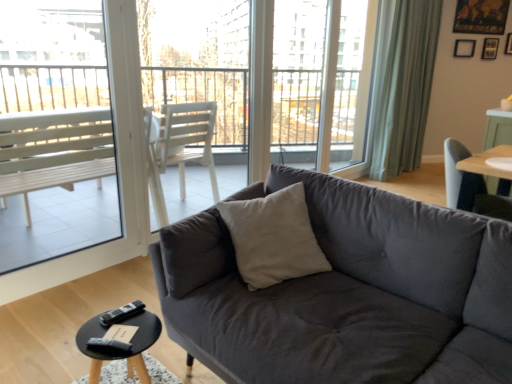
Question: Considering the positions of white plastic bench at left, marked as the first window screen in a left-to-right arrangement, and green fabric curtain at upper right in the image, is white plastic bench at left, marked as the first window screen in a left-to-right arrangement, taller or shorter than green fabric curtain at upper right?

Choices:
 (A) tall
 (B) short

Answer: (B)

Question: Considering the positions of point (113, 205) and point (388, 28), is point (113, 205) closer or farther from the camera than point (388, 28)?

Choices:
 (A) farther
 (B) closer

Answer: (B)

Question: Estimate the real-world distances between objects in this image. Which object is farther from the dark gray fabric couch at center?

Choices:
 (A) black plastic remote at lower left, which is the second remote in back-to-front order
 (B) wooden picture frame at upper right, which is counted as the 2th picture frame, starting from the left
 (C) light blue fabric chair at right
 (D) transparent glass screen door at upper center
 (E) black wood coffee table at lower left

Answer: (B)

Question: Which object is the farthest from the black plastic remote at lower left, marked as the first remote in a bottom-to-top arrangement?

Choices:
 (A) transparent glass screen door at upper center
 (B) white plastic chair at upper center, the 1th window screen when ordered from right to left
 (C) white plastic bench at left, marked as the first window screen in a left-to-right arrangement
 (D) light blue fabric chair at right
 (E) black plastic remote at lower left, which is the 2th remote in bottom-to-top order

Answer: (B)